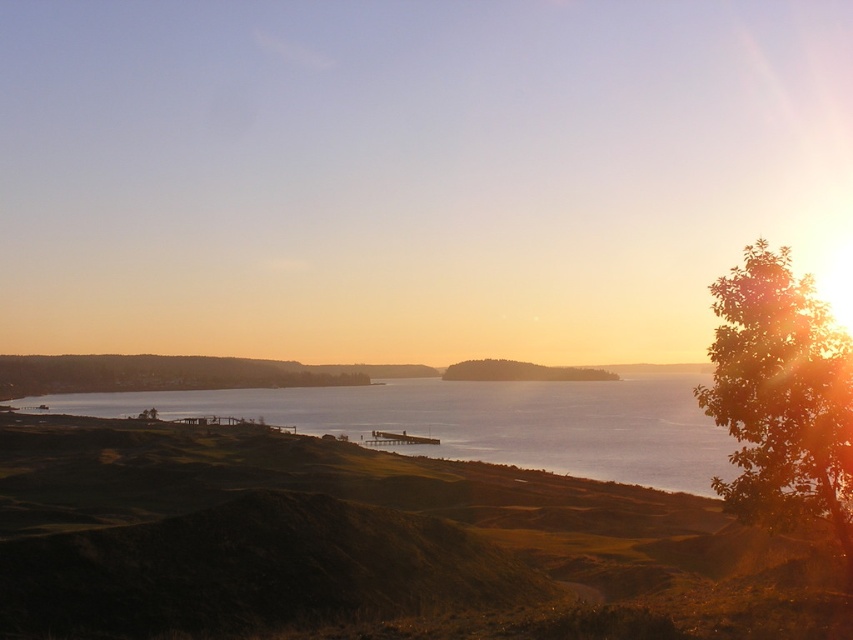
Between green grassy hillside at lower left and green leafy tree at center, which one appears on the right side from the viewer's perspective?

green leafy tree at center

Is point (527, 602) behind point (473, 376)?

No, it is not.

I want to click on green grassy hillside at lower left, so click(x=369, y=545).

Which of these two, green grassy hillside at lower left or green leafy tree at right, stands taller?

green grassy hillside at lower left

Does point (732, 536) come behind point (824, 515)?

Yes, it is.

Find the location of `green grassy hillside at lower left`. green grassy hillside at lower left is located at coordinates (369, 545).

Can you confirm if green leafy tree at right is bigger than green leafy tree at center?

Actually, green leafy tree at right might be smaller than green leafy tree at center.

Between green leafy tree at right and green leafy tree at center, which one is positioned higher?

green leafy tree at right

At what (x,y) coordinates should I click in order to perform the action: click on green leafy tree at right. Please return your answer as a coordinate pair (x, y). The image size is (853, 640). Looking at the image, I should click on (781, 396).